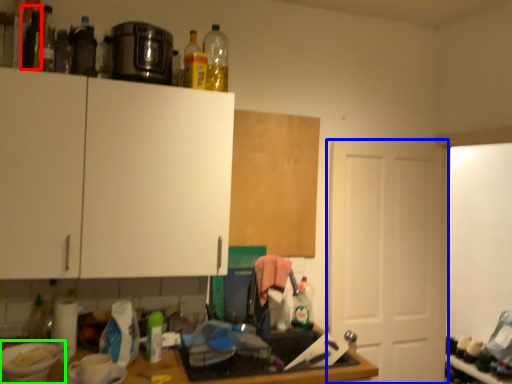
Question: Which object is the closest to the bottle (highlighted by a red box)? Choose among these: door (highlighted by a blue box) or appliance (highlighted by a green box).

Choices:
 (A) door
 (B) appliance

Answer: (B)